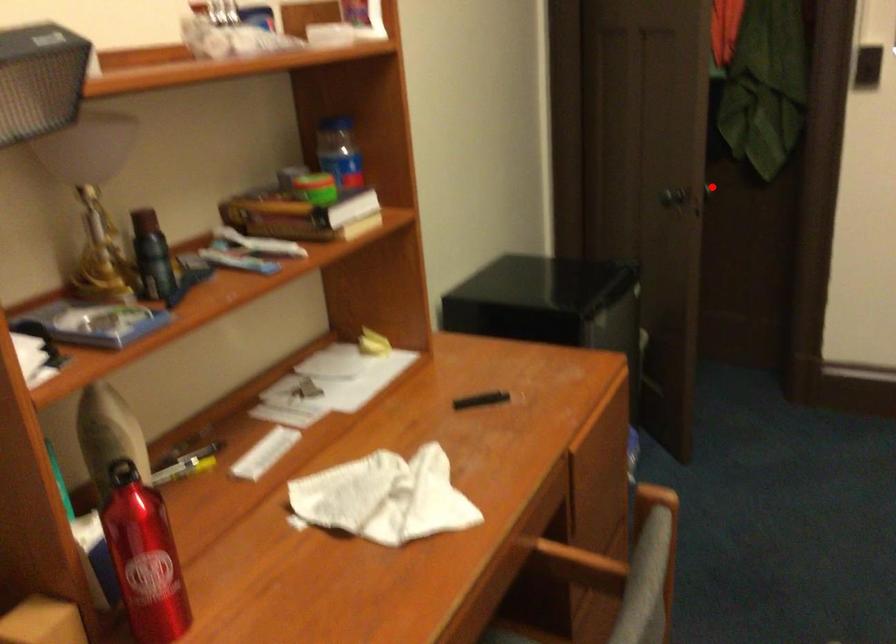
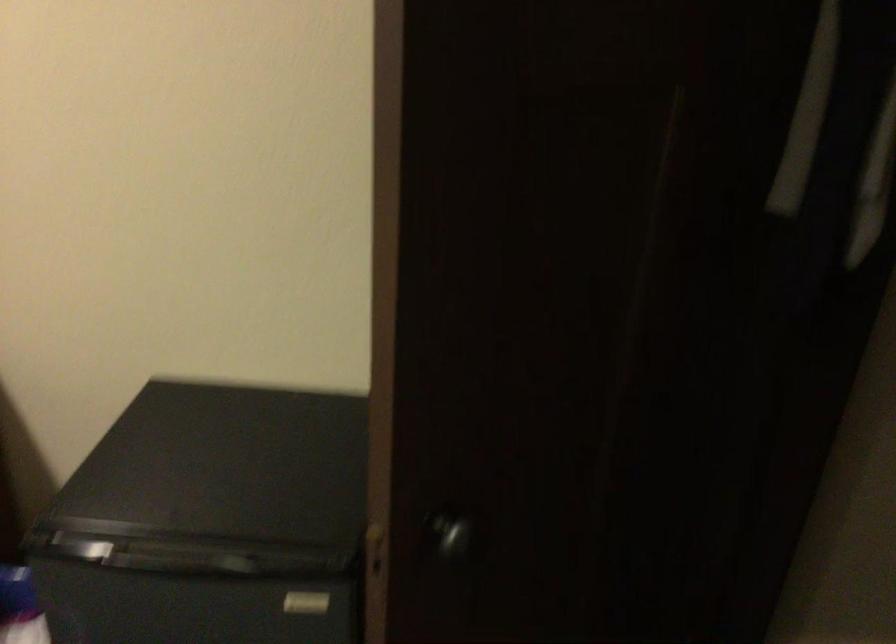
Question: I am providing you with two images of the same scene from different viewpoints. In image1, a red point is highlighted. Considering the same 3D point in image2, which of the following is correct?

Choices:
 (A) It is closer
 (B) It is farther

Answer: (A)